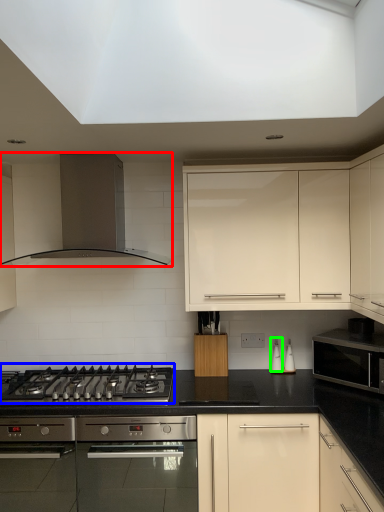
Question: Estimate the real-world distances between objects in this image. Which object is farther from kitchen appliance (highlighted by a red box), gas stove (highlighted by a blue box) or appliance (highlighted by a green box)?

Choices:
 (A) gas stove
 (B) appliance

Answer: (B)